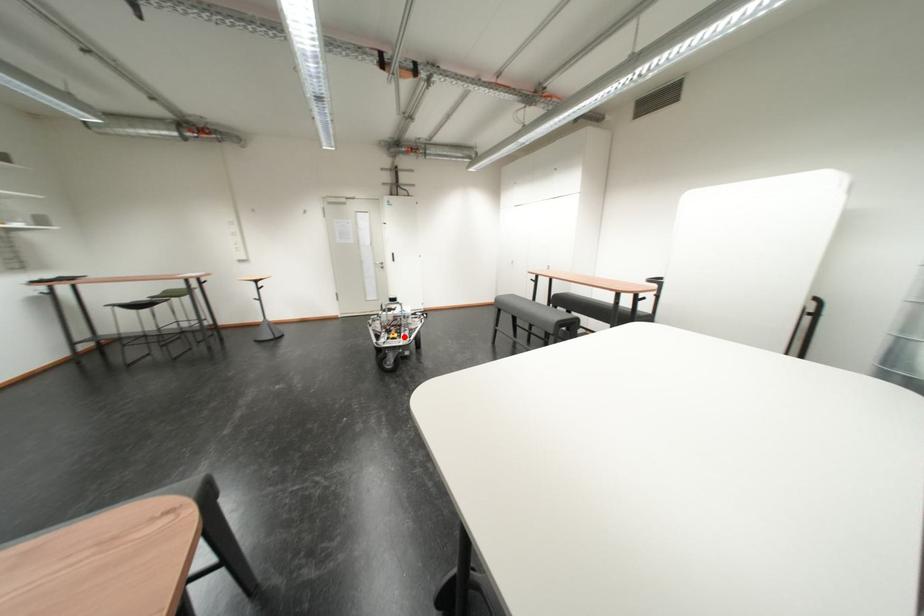
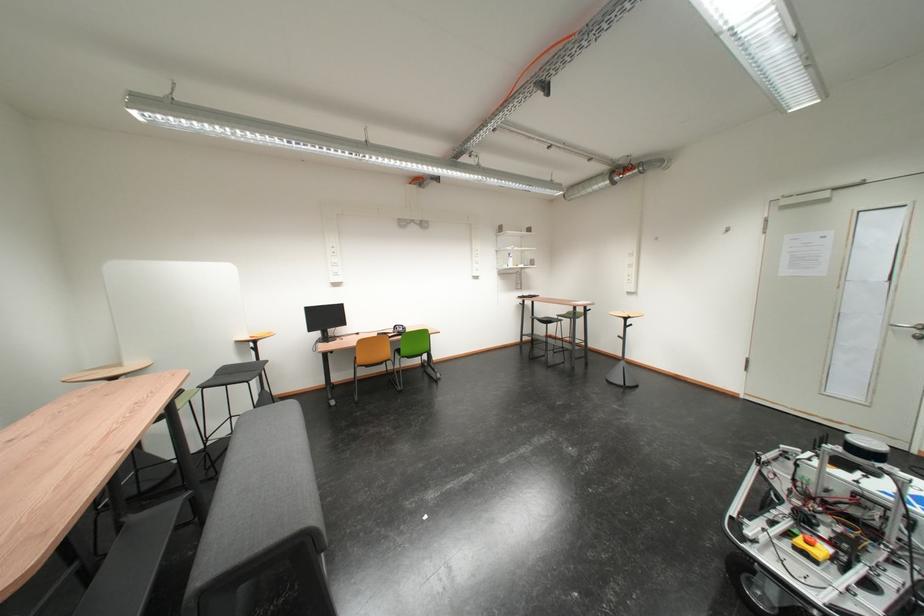
Question: I am providing you with two images of the same scene from different viewpoints. Image1 has a red point marked. In image2, the corresponding 3D location appears at what relative position? Reply with the corresponding letter.

Choices:
 (A) Closer
 (B) Farther

Answer: (B)